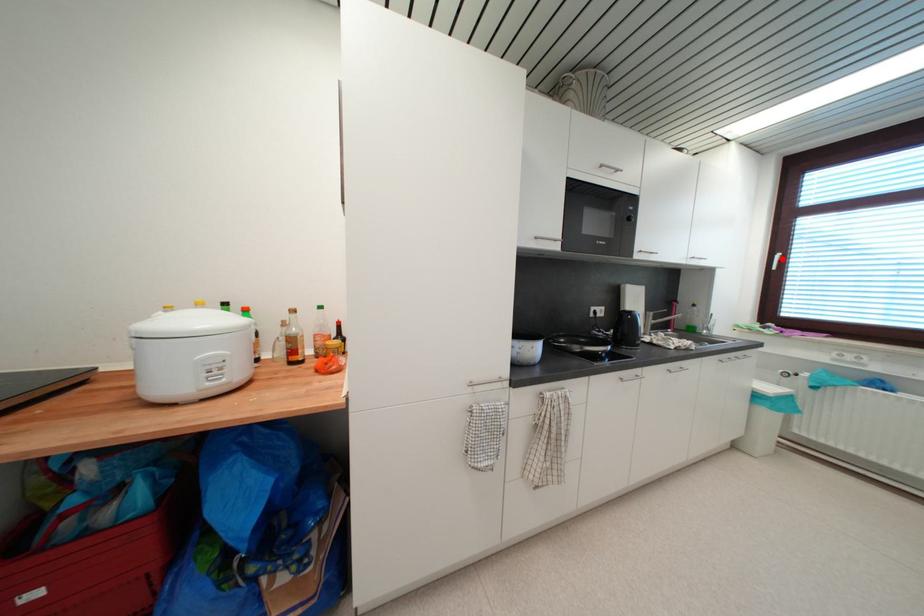
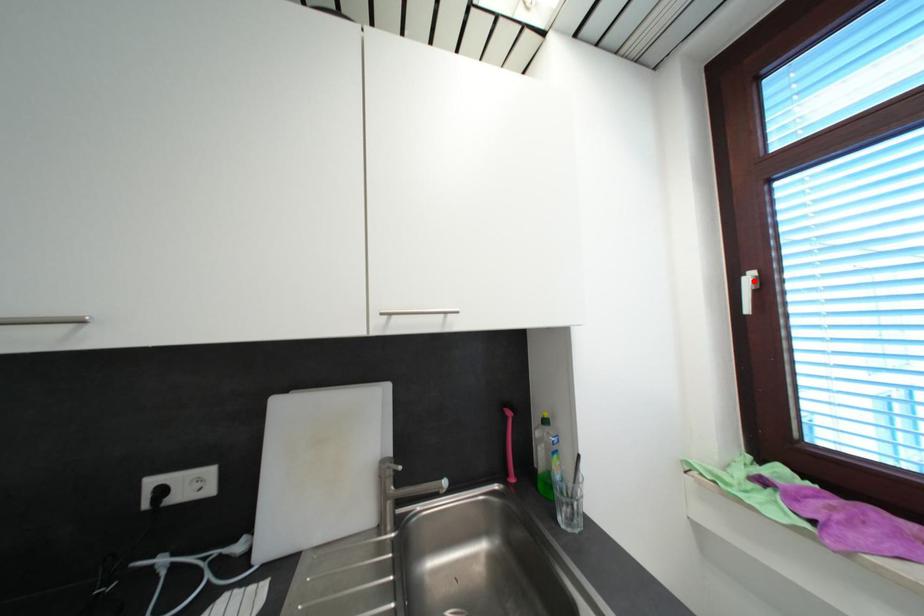
I am providing you with two images of the same scene from different viewpoints. A red point is marked on the first image and another point is marked on the second image. Are the points marked in image1 and image2 representing the same 3D position?

Yes